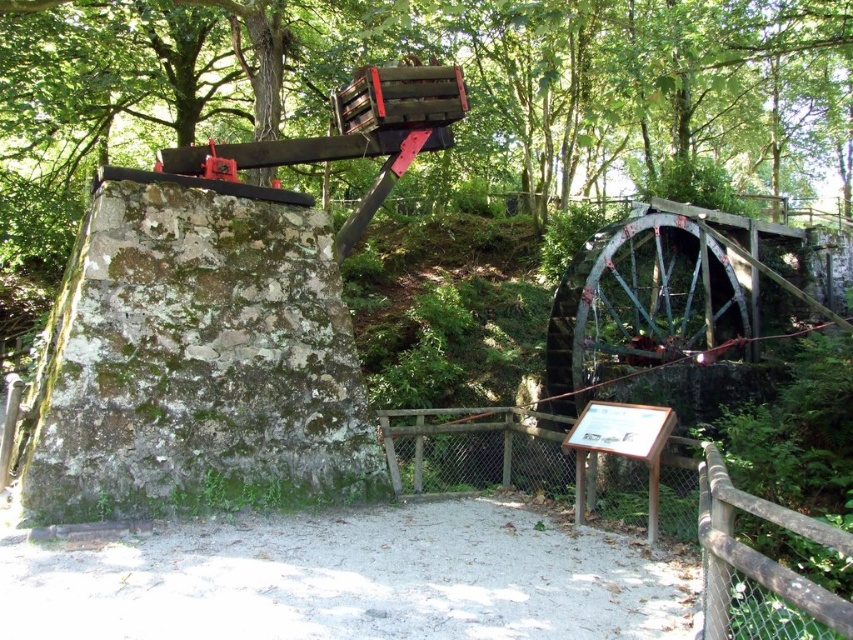
You are a hiker who wants to read the brown wooden sign at center. You are currently standing at the green mossy stone at left. Which direction should you walk to reach the sign?

The green mossy stone at left is to the left of the brown wooden sign at center, so you should walk to the right to reach the sign.

You are standing in front of the old watermill and want to read the brown wooden sign at center. Since the dirt ground at center is in your way, will you need to step up or step down to see the sign clearly?

The dirt ground at center is shorter than the brown wooden sign at center, so you will need to step up to see the sign clearly.

Looking at this image, you are standing at the entrance of the old watermill and see the dirt ground at center and the brown wooden sign at center. Which object is closer to you?

The dirt ground at center is closer to you because it is in front of the brown wooden sign at center.